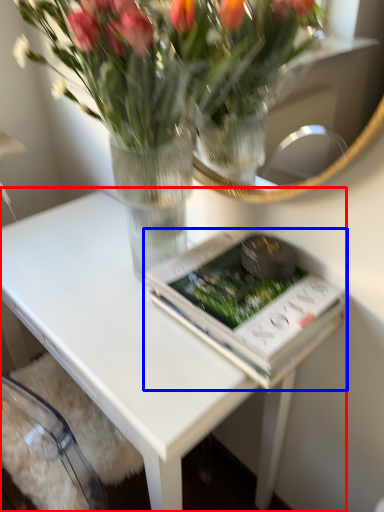
Question: Which object appears farthest to the camera in this image, table (highlighted by a red box) or paperback book (highlighted by a blue box)?

Choices:
 (A) table
 (B) paperback book

Answer: (B)